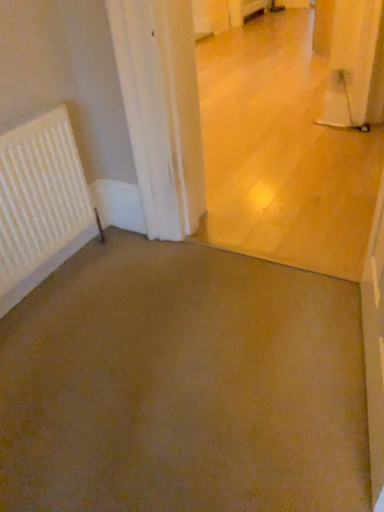
Question: Does brown matte concrete at center, the 1th concrete viewed from the top, lie behind white matte radiator at left?

Choices:
 (A) no
 (B) yes

Answer: (A)

Question: From the image's perspective, is brown matte concrete at center, the 1th concrete viewed from the top, located above white matte radiator at left?

Choices:
 (A) yes
 (B) no

Answer: (A)

Question: Is white matte radiator at left at the back of brown matte concrete at center, marked as the second concrete in a bottom-to-top arrangement?

Choices:
 (A) yes
 (B) no

Answer: (B)

Question: Could white matte radiator at left be considered to be inside brown matte concrete at center, the 1th concrete viewed from the top?

Choices:
 (A) yes
 (B) no

Answer: (B)

Question: Considering the relative sizes of brown matte concrete at center, the 1th concrete viewed from the top, and white matte radiator at left in the image provided, is brown matte concrete at center, the 1th concrete viewed from the top, shorter than white matte radiator at left?

Choices:
 (A) no
 (B) yes

Answer: (A)

Question: Is brown carpet at lower left, arranged as the second concrete when viewed from the top, inside or outside of brown matte concrete at center, marked as the second concrete in a bottom-to-top arrangement?

Choices:
 (A) outside
 (B) inside

Answer: (A)

Question: From the image's perspective, is brown carpet at lower left, the first concrete when ordered from bottom to top, located above or below brown matte concrete at center, marked as the second concrete in a bottom-to-top arrangement?

Choices:
 (A) above
 (B) below

Answer: (B)

Question: Visually, is brown carpet at lower left, arranged as the second concrete when viewed from the top, positioned to the left or to the right of brown matte concrete at center, marked as the second concrete in a bottom-to-top arrangement?

Choices:
 (A) left
 (B) right

Answer: (A)

Question: Looking at the image, does brown carpet at lower left, arranged as the second concrete when viewed from the top, seem bigger or smaller compared to brown matte concrete at center, the 1th concrete viewed from the top?

Choices:
 (A) small
 (B) big

Answer: (A)

Question: Is brown carpet at lower left, arranged as the second concrete when viewed from the top, bigger or smaller than white matte radiator at left?

Choices:
 (A) small
 (B) big

Answer: (B)

Question: Based on their positions, is brown carpet at lower left, the first concrete when ordered from bottom to top, located to the left or right of white matte radiator at left?

Choices:
 (A) right
 (B) left

Answer: (A)

Question: In terms of width, does brown carpet at lower left, the first concrete when ordered from bottom to top, look wider or thinner when compared to white matte radiator at left?

Choices:
 (A) thin
 (B) wide

Answer: (B)

Question: Do you think brown carpet at lower left, arranged as the second concrete when viewed from the top, is within white matte radiator at left, or outside of it?

Choices:
 (A) outside
 (B) inside

Answer: (A)

Question: From a real-world perspective, is white matte radiator at left above or below brown carpet at lower left, the first concrete when ordered from bottom to top?

Choices:
 (A) above
 (B) below

Answer: (A)

Question: In the image, is white matte radiator at left positioned in front of or behind brown carpet at lower left, the first concrete when ordered from bottom to top?

Choices:
 (A) behind
 (B) front

Answer: (A)